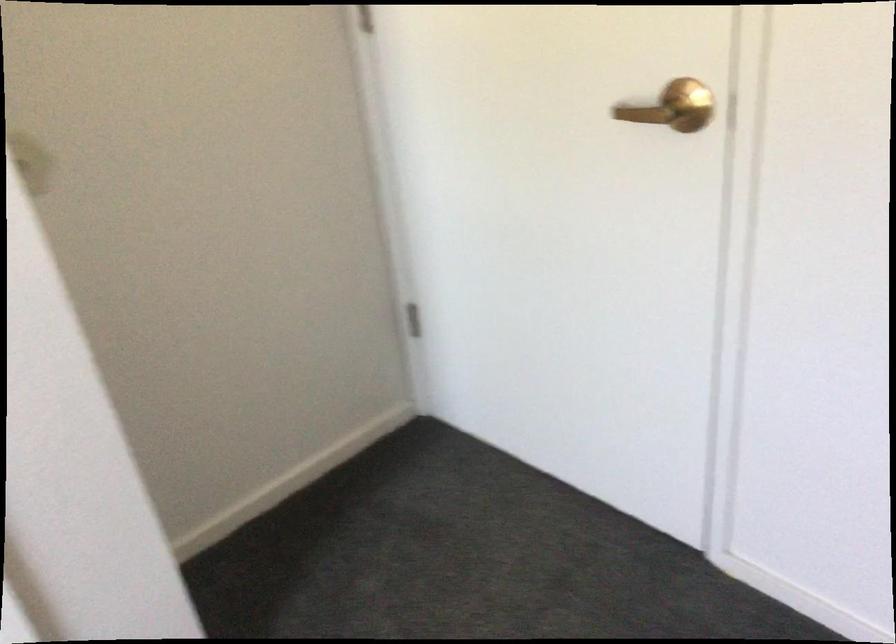
At what (x,y) coordinates should I click in order to perform the action: click on gold doorknob. Please return your answer as a coordinate pair (x, y). This screenshot has height=644, width=896. Looking at the image, I should click on (673, 107).